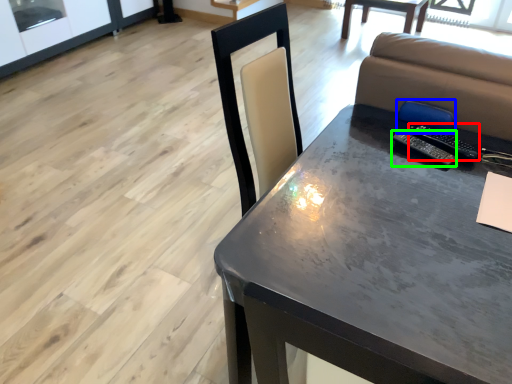
Question: Which object is positioned closest to remote (highlighted by a red box)? Select from armchair (highlighted by a blue box) and remote (highlighted by a green box).

Choices:
 (A) armchair
 (B) remote

Answer: (A)